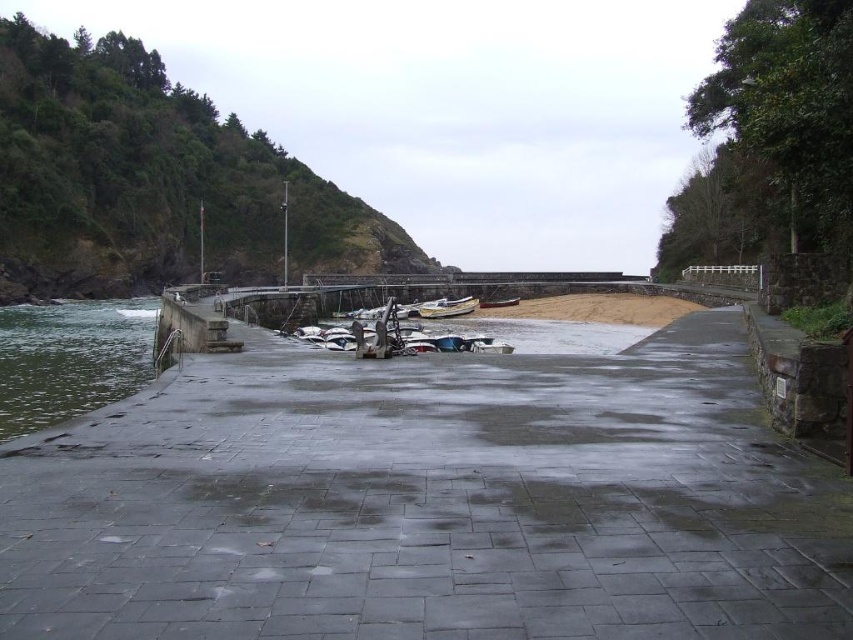
Question: Estimate the real-world distances between objects in this image. Which object is farther from the smooth concrete dock at center?

Choices:
 (A) white matte boat at center
 (B) green smooth water at lower left

Answer: (A)

Question: Which of the following is the farthest from the observer?

Choices:
 (A) smooth concrete dock at center
 (B) wooden boat at center
 (C) green smooth water at lower left
 (D) white matte boat at center

Answer: (B)

Question: Where is white matte boat at center located in relation to wooden boat at center in the image?

Choices:
 (A) right
 (B) left

Answer: (B)

Question: Where is smooth concrete dock at center located in relation to green smooth water at lower left in the image?

Choices:
 (A) left
 (B) right

Answer: (B)

Question: Among these points, which one is farthest from the camera?

Choices:
 (A) (509, 301)
 (B) (142, 339)

Answer: (A)

Question: Observing the image, what is the correct spatial positioning of smooth concrete dock at center in reference to wooden boat at center?

Choices:
 (A) right
 (B) left

Answer: (B)